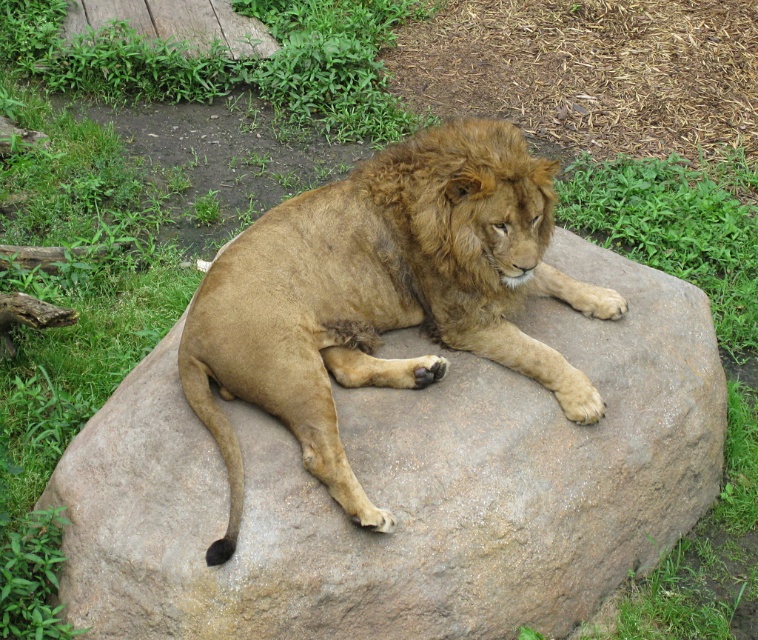
Question: Does golden fur lion at center appear on the right side of brown fuzzy mane at center?

Choices:
 (A) yes
 (B) no

Answer: (B)

Question: Can you confirm if golden fur lion at center is positioned to the right of brown fuzzy mane at center?

Choices:
 (A) no
 (B) yes

Answer: (A)

Question: Can you confirm if golden fur lion at center is positioned to the right of brown fuzzy mane at center?

Choices:
 (A) no
 (B) yes

Answer: (A)

Question: Which point is farther from the camera taking this photo?

Choices:
 (A) (509, 204)
 (B) (274, 284)

Answer: (B)

Question: Among these objects, which one is nearest to the camera?

Choices:
 (A) brown fuzzy mane at center
 (B) golden fur lion at center

Answer: (B)